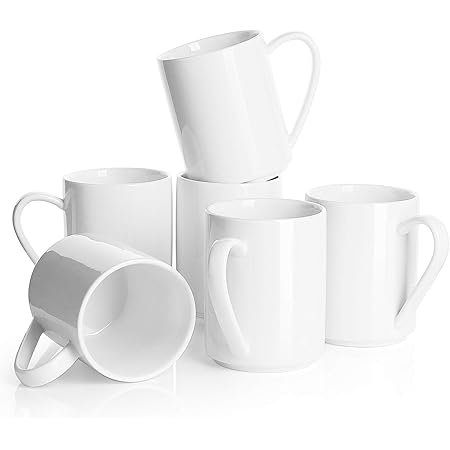
Locate an element on the screen. mug handles is located at coordinates (21, 200), (284, 40), (438, 249), (218, 280), (54, 370).